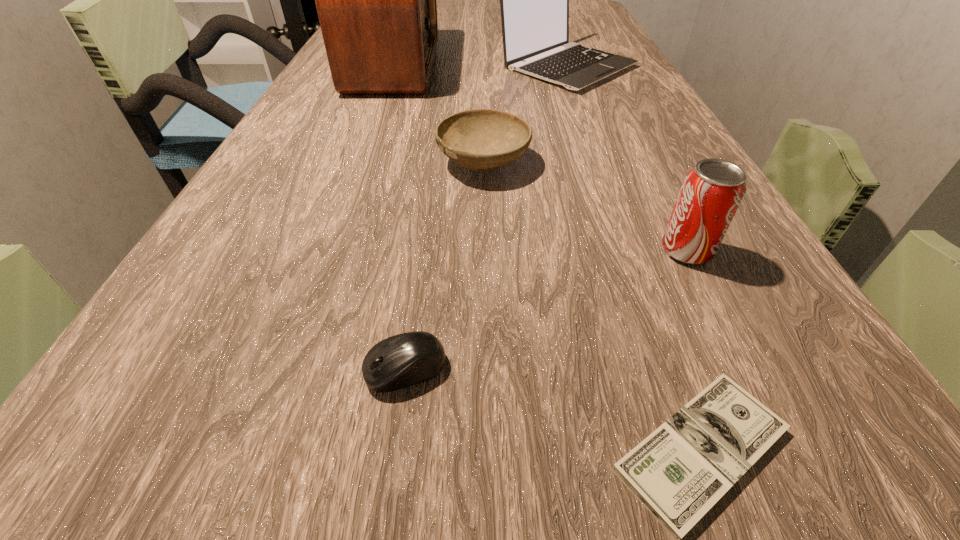
Identify the location of vacant area between the third tallest object and the radio receiver. (540, 158).

The width and height of the screenshot is (960, 540). I want to click on vacant space that is in between the laptop_computer and the third shortest object, so click(x=525, y=114).

At what (x,y) coordinates should I click in order to perform the action: click on object identified as the second closest to the radio receiver. Please return your answer as a coordinate pair (x, y). Image resolution: width=960 pixels, height=540 pixels. Looking at the image, I should click on (479, 139).

This screenshot has width=960, height=540. Identify the location of the closest object to the shortest object. (402, 360).

Identify the location of free region that satisfies the following two spatial constraints: 1. on the front panel of the bowl; 2. on the left side of the radio receiver. This screenshot has width=960, height=540. (358, 163).

This screenshot has height=540, width=960. What are the coordinates of `vacant space that satisfies the following two spatial constraints: 1. on the front side of the third nearest object; 2. on the left side of the third shortest object` in the screenshot? It's located at (485, 251).

Where is `free spot that satisfies the following two spatial constraints: 1. on the back side of the fifth tallest object; 2. on the left side of the third tallest object`? Image resolution: width=960 pixels, height=540 pixels. free spot that satisfies the following two spatial constraints: 1. on the back side of the fifth tallest object; 2. on the left side of the third tallest object is located at coordinates (421, 251).

Locate an element on the screen. The image size is (960, 540). free spot that satisfies the following two spatial constraints: 1. on the front panel of the mouse; 2. on the left side of the radio receiver is located at coordinates (281, 369).

Where is `vacant space that satisfies the following two spatial constraints: 1. on the back side of the fifth tallest object; 2. on the left side of the fourth farthest object`? vacant space that satisfies the following two spatial constraints: 1. on the back side of the fifth tallest object; 2. on the left side of the fourth farthest object is located at coordinates (421, 251).